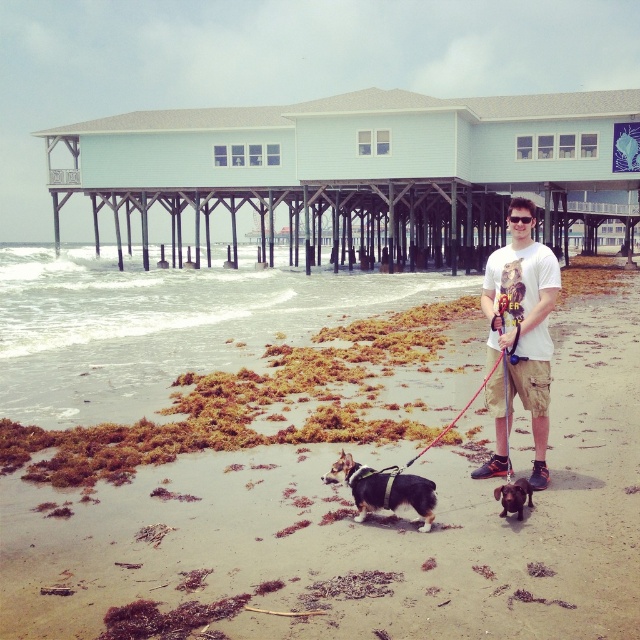
Question: Considering the real-world distances, which object is closest to the brown and white fur at center?

Choices:
 (A) black glossy dog at lower center
 (B) brown sandy beach at lower center
 (C) light blue wooden pier at upper center

Answer: (A)

Question: Is white cotton t-shirt at center to the right of brown and white fur at center from the viewer's perspective?

Choices:
 (A) yes
 (B) no

Answer: (A)

Question: Which of these objects is positioned farthest from the brown and white fur at center?

Choices:
 (A) black glossy dog at lower center
 (B) white cotton t-shirt at center
 (C) light blue wooden pier at upper center

Answer: (C)

Question: Where is light blue wooden pier at upper center located in relation to white cotton t-shirt at center in the image?

Choices:
 (A) below
 (B) above

Answer: (B)

Question: Does white cotton t-shirt at center have a greater width compared to black glossy dog at lower center?

Choices:
 (A) no
 (B) yes

Answer: (B)

Question: Which of these objects is positioned farthest from the light blue wooden pier at upper center?

Choices:
 (A) brown and white fur at center
 (B) black glossy dog at lower center

Answer: (B)